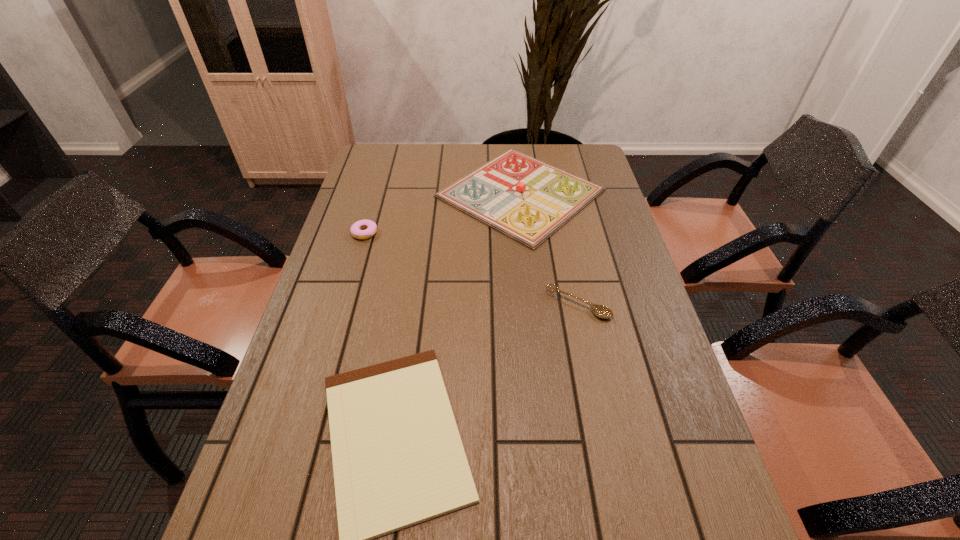
Where is `ladle that is at the right edge`? The width and height of the screenshot is (960, 540). ladle that is at the right edge is located at coordinates (601, 311).

You are a GUI agent. You are given a task and a screenshot of the screen. Output one action in this format:
    pyautogui.click(x=<x>, y=<y>)
    Task: Click on the object that is at the far right corner
    Image resolution: width=960 pixels, height=540 pixels.
    Given the screenshot: What is the action you would take?
    pyautogui.click(x=528, y=200)

In the image, there is a desktop. Where is `vacant area at the far edge`? This screenshot has width=960, height=540. vacant area at the far edge is located at coordinates (434, 160).

I want to click on vacant region at the left edge of the desktop, so click(x=278, y=397).

Locate an element on the screen. The height and width of the screenshot is (540, 960). vacant space at the right edge is located at coordinates (595, 202).

At what (x,y) coordinates should I click in order to perform the action: click on vacant space in between the second nearest object and the tallest object. Please return your answer as a coordinate pair (x, y). Image resolution: width=960 pixels, height=540 pixels. Looking at the image, I should click on (549, 248).

Locate an element on the screen. vacant space in between the gameboard and the ladle is located at coordinates (549, 248).

This screenshot has height=540, width=960. In order to click on blank region between the doughnut and the tallest object in this screenshot , I will do `click(443, 213)`.

Locate an element on the screen. This screenshot has width=960, height=540. blank region between the gameboard and the third shortest object is located at coordinates (443, 213).

Locate which object ranks third in proximity to the shortest object. Please provide its 2D coordinates. Your answer should be formatted as a tuple, i.e. [(x, y)], where the tuple contains the x and y coordinates of a point satisfying the conditions above.

[(370, 227)]